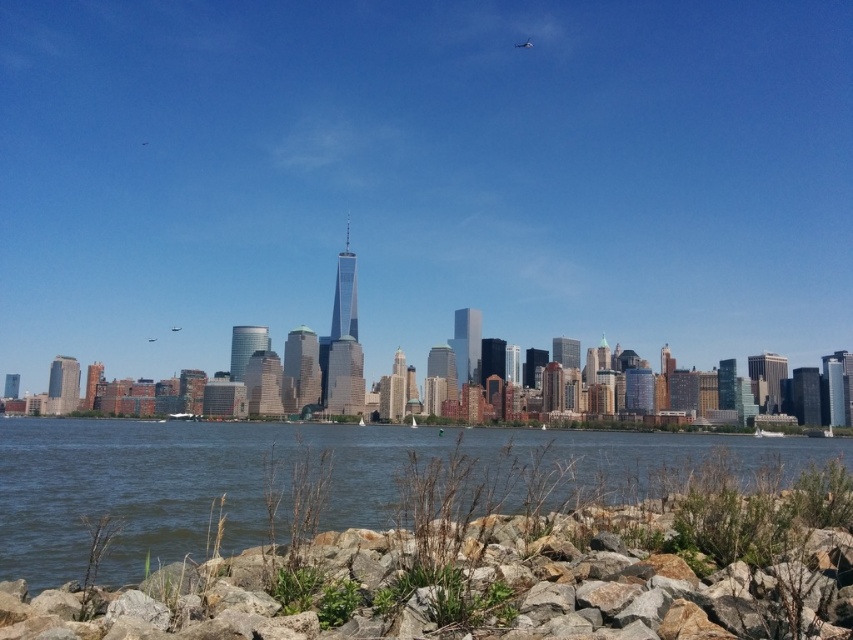
Question: Can you confirm if rocky shore at lower center is positioned to the right of clear water at lower center?

Choices:
 (A) no
 (B) yes

Answer: (B)

Question: Is rocky shore at lower center closer to camera compared to clear water at lower center?

Choices:
 (A) no
 (B) yes

Answer: (B)

Question: Which point is farther to the camera?

Choices:
 (A) (239, 557)
 (B) (751, 472)

Answer: (B)

Question: Which of the following is the closest to the observer?

Choices:
 (A) (132, 460)
 (B) (648, 595)

Answer: (B)

Question: Which point is closer to the camera?

Choices:
 (A) clear water at lower center
 (B) rocky shore at lower center

Answer: (B)

Question: Is rocky shore at lower center positioned behind clear water at lower center?

Choices:
 (A) yes
 (B) no

Answer: (B)